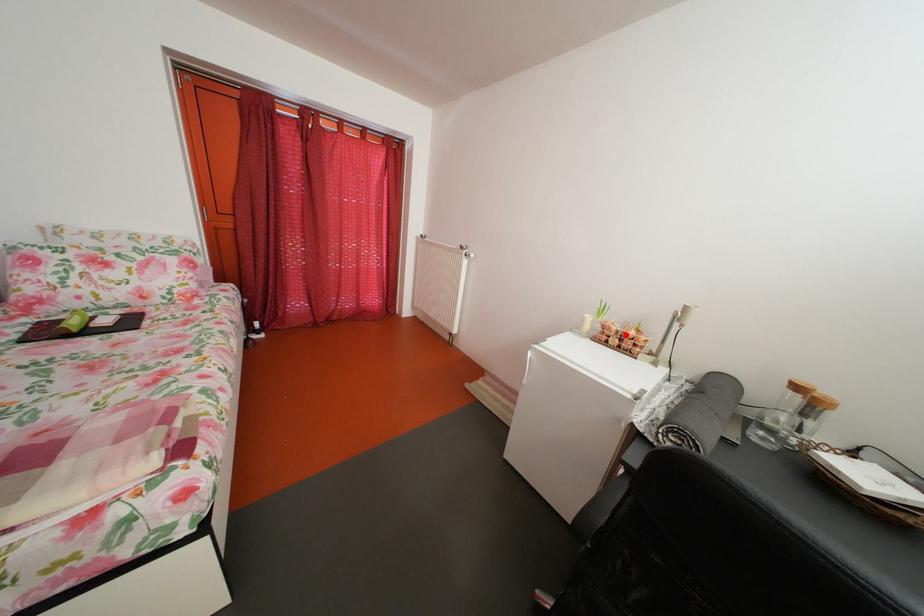
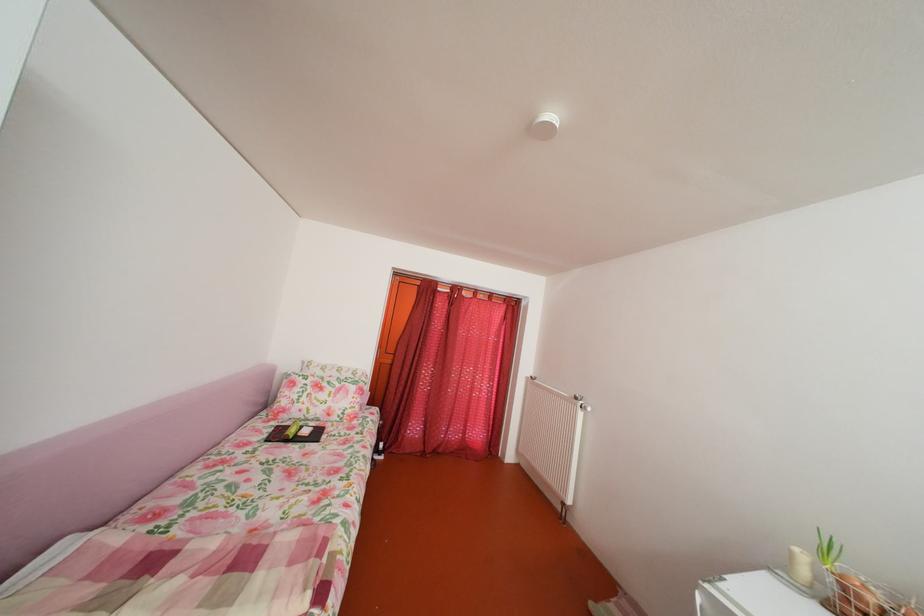
Find the pixel in the second image that matches the highlighted location in the first image.

(882, 607)